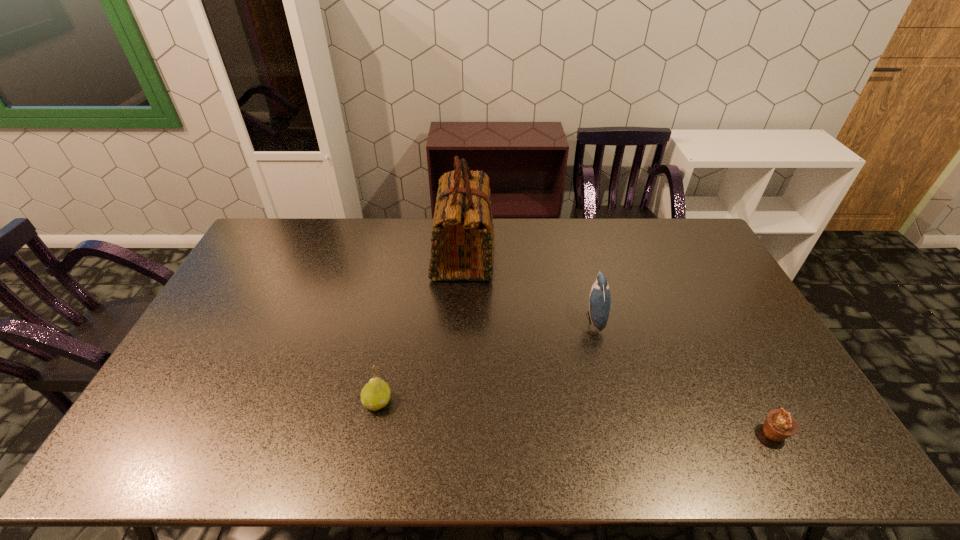
This screenshot has height=540, width=960. I want to click on vacant space that's between the rightmost object and the farthest object, so click(x=619, y=344).

Identify the location of free space between the rightmost object and the second shortest object. The width and height of the screenshot is (960, 540). (575, 417).

This screenshot has width=960, height=540. I want to click on free space between the muffin and the farthest object, so click(619, 344).

Select which object is the second closest to the shortest object. Please provide its 2D coordinates. Your answer should be formatted as a tuple, i.e. [(x, y)], where the tuple contains the x and y coordinates of a point satisfying the conditions above.

[(462, 248)]

Locate an element on the screen. the third closest object to the farthest object is located at coordinates [779, 425].

Where is `vacant point that satisfies the following two spatial constraints: 1. on the open handle side of the farthest object; 2. on the back side of the muffin`? vacant point that satisfies the following two spatial constraints: 1. on the open handle side of the farthest object; 2. on the back side of the muffin is located at coordinates (456, 434).

I want to click on vacant region that satisfies the following two spatial constraints: 1. at the tip of the nearest object's beak; 2. on the right side of the bird, so click(x=624, y=434).

What are the coordinates of `free space that satisfies the following two spatial constraints: 1. on the open handle side of the nearest object; 2. on the left side of the shopping bag` in the screenshot? It's located at (456, 434).

Find the location of a particular element. This screenshot has width=960, height=540. free space in the image that satisfies the following two spatial constraints: 1. on the open handle side of the muffin; 2. on the left side of the shopping bag is located at coordinates (456, 434).

Find the location of a particular element. vacant region that satisfies the following two spatial constraints: 1. on the back side of the shortest object; 2. at the tip of the second tallest object's beak is located at coordinates (712, 319).